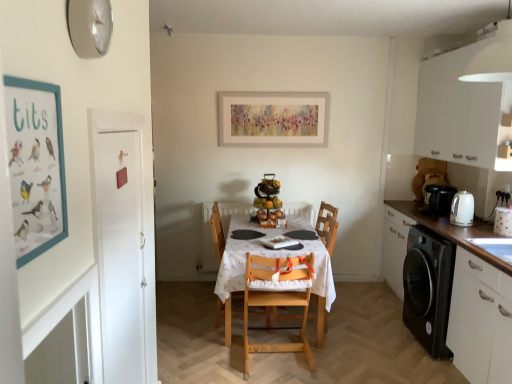
The image size is (512, 384). Find the location of `white matte door at left`. white matte door at left is located at coordinates (120, 252).

In order to face white matte door at left, should I rotate leftwards or rightwards?

Rotate your view left by about 17.303°.

Identify the location of white wood table at center. pos(324,278).

What do you see at coordinates (324, 278) in the screenshot?
I see `white wood table at center` at bounding box center [324, 278].

This screenshot has height=384, width=512. What do you see at coordinates (327, 225) in the screenshot?
I see `wooden highchair at center` at bounding box center [327, 225].

The width and height of the screenshot is (512, 384). What are the coordinates of `white matte cabinet at upper right, which is counted as the 1th cabinetry, starting from the top` in the screenshot? It's located at (x=468, y=103).

Is white ceramic kettle at right, acting as the first appliance starting from the right, next to white matte cabinet at upper right, which is the 2th cabinetry in bottom-to-top order?

white ceramic kettle at right, acting as the first appliance starting from the right, is not next to white matte cabinet at upper right, which is the 2th cabinetry in bottom-to-top order, and they're not touching.

Locate an element on the screen. The width and height of the screenshot is (512, 384). cabinetry that is the 1st one when counting leftward from the white ceramic kettle at right, which is the second appliance from left to right is located at coordinates (468, 103).

Can you tell me how much white ceramic kettle at right, placed as the 2th appliance when sorted from back to front, and white matte cabinet at upper right, which is the 2th cabinetry in bottom-to-top order, differ in facing direction?

They differ by 7.65e-05 degrees in their facing directions.

From the picture: Is white ceramic kettle at right, placed as the 2th appliance when sorted from back to front, smaller than white matte cabinet at upper right, which is the 2th cabinetry in bottom-to-top order?

Correct, white ceramic kettle at right, placed as the 2th appliance when sorted from back to front, occupies less space than white matte cabinet at upper right, which is the 2th cabinetry in bottom-to-top order.

Between natural wood highchair at center, positioned as the second chair in back-to-front order, and silver metallic clock at upper left, which one appears on the right side from the viewer's perspective?

From the viewer's perspective, natural wood highchair at center, positioned as the second chair in back-to-front order, appears more on the right side.

Is natural wood highchair at center, positioned as the second chair in back-to-front order, facing towards silver metallic clock at upper left?

No, natural wood highchair at center, positioned as the second chair in back-to-front order, is not aimed at silver metallic clock at upper left.

Is the position of natural wood highchair at center, arranged as the first chair when viewed from the front, less distant than that of silver metallic clock at upper left?

No, it is not.

From the image's perspective, is natural wood highchair at center, arranged as the first chair when viewed from the front, beneath silver metallic clock at upper left?

Yes, from the image's perspective, natural wood highchair at center, arranged as the first chair when viewed from the front, is beneath silver metallic clock at upper left.

From a real-world perspective, which object rests below the other?

From a 3D spatial view, natural wood highchair at center, arranged as the first chair when viewed from the front, is below.

How different are the orientations of natural wood highchair at center, positioned as the second chair in back-to-front order, and matte cardboard poster at left in degrees?

The facing directions of natural wood highchair at center, positioned as the second chair in back-to-front order, and matte cardboard poster at left are 90 degrees apart.

Which is in front, point (301, 324) or point (9, 94)?

The point (9, 94) is closer.

Considering the relative sizes of natural wood highchair at center, positioned as the second chair in back-to-front order, and matte cardboard poster at left in the image provided, is natural wood highchair at center, positioned as the second chair in back-to-front order, shorter than matte cardboard poster at left?

In fact, natural wood highchair at center, positioned as the second chair in back-to-front order, may be taller than matte cardboard poster at left.

Could you tell me if white glossy cabinet at lower right, the 1th cabinetry in the bottom-to-top sequence, is turned towards white ceramic kettle at right, placed as the 2th appliance when sorted from back to front?

No, white glossy cabinet at lower right, the 1th cabinetry in the bottom-to-top sequence, is not aimed at white ceramic kettle at right, placed as the 2th appliance when sorted from back to front.

In terms of height, does white glossy cabinet at lower right, the 1th cabinetry in the bottom-to-top sequence, look taller or shorter compared to white ceramic kettle at right, which is the second appliance from left to right?

In the image, white glossy cabinet at lower right, the 1th cabinetry in the bottom-to-top sequence, appears to be taller than white ceramic kettle at right, which is the second appliance from left to right.

From a real-world perspective, is white glossy cabinet at lower right, the 1th cabinetry in the bottom-to-top sequence, under white ceramic kettle at right, acting as the first appliance starting from the right?

Yes, from a real-world perspective, white glossy cabinet at lower right, the 1th cabinetry in the bottom-to-top sequence, is under white ceramic kettle at right, acting as the first appliance starting from the right.

Is white glossy cabinet at lower right, the 1th cabinetry in the bottom-to-top sequence, to the right of white ceramic kettle at right, acting as the first appliance starting from the right, from the viewer's perspective?

No, white glossy cabinet at lower right, the 1th cabinetry in the bottom-to-top sequence, is not to the right of white ceramic kettle at right, acting as the first appliance starting from the right.

Considering the sizes of objects black plastic coffee machine at right and white glossy cabinet at lower right, which is counted as the second cabinetry, starting from the top, in the image provided, who is taller, black plastic coffee machine at right or white glossy cabinet at lower right, which is counted as the second cabinetry, starting from the top,?

Standing taller between the two is white glossy cabinet at lower right, which is counted as the second cabinetry, starting from the top.

Considering the positions of objects black plastic coffee machine at right and white glossy cabinet at lower right, which is counted as the second cabinetry, starting from the top, in the image provided, who is more to the right, black plastic coffee machine at right or white glossy cabinet at lower right, which is counted as the second cabinetry, starting from the top,?

From the viewer's perspective, black plastic coffee machine at right appears more on the right side.

Which of these two, black plastic coffee machine at right or white glossy cabinet at lower right, which is counted as the second cabinetry, starting from the top, is bigger?

With larger size is white glossy cabinet at lower right, which is counted as the second cabinetry, starting from the top.

Can you see black plastic coffee machine at right touching white glossy cabinet at lower right, which is counted as the second cabinetry, starting from the top?

There is a gap between black plastic coffee machine at right and white glossy cabinet at lower right, which is counted as the second cabinetry, starting from the top.

Considering the sizes of objects white matte door at left and wooden chair at center, which is counted as the first chair, starting from the back, in the image provided, who is wider, white matte door at left or wooden chair at center, which is counted as the first chair, starting from the back,?

wooden chair at center, which is counted as the first chair, starting from the back.

Does white matte door at left have a larger size compared to wooden chair at center, which is counted as the first chair, starting from the back?

No, white matte door at left is not bigger than wooden chair at center, which is counted as the first chair, starting from the back.

From the image's perspective, is white matte door at left located above or below wooden chair at center, acting as the second chair starting from the front?

white matte door at left is above wooden chair at center, acting as the second chair starting from the front.

Is white wood table at center wider or thinner than wooden chair at center, acting as the second chair starting from the front?

white wood table at center is wider than wooden chair at center, acting as the second chair starting from the front.

Between white wood table at center and wooden chair at center, which is counted as the first chair, starting from the back, which one appears on the left side from the viewer's perspective?

Positioned to the left is wooden chair at center, which is counted as the first chair, starting from the back.

Is point (317, 326) closer to viewer compared to point (213, 224)?

That is True.

Consider the image. Is wooden chair at center, which is counted as the first chair, starting from the back, a part of white wood table at center?

Indeed, wooden chair at center, which is counted as the first chair, starting from the back, is located within white wood table at center.

From the white matte cabinet at upper right, which is counted as the 1th cabinetry, starting from the top, count 1st appliances backward and point to it. Please provide its 2D coordinates.

[(503, 221)]

The height and width of the screenshot is (384, 512). Find the location of `the 2nd chair counting from the right of the silver metallic clock at upper left`. the 2nd chair counting from the right of the silver metallic clock at upper left is located at coordinates (278, 301).

When comparing their distances from wooden highchair at center, does matte cardboard poster at left or natural wood highchair at center, arranged as the first chair when viewed from the front, seem closer?

Based on the image, natural wood highchair at center, arranged as the first chair when viewed from the front, appears to be nearer to wooden highchair at center.

Considering their positions, is white glossy cabinet at lower right, the 1th cabinetry in the bottom-to-top sequence, positioned closer to white glossy electric kettle at right, positioned as the 2th appliance in right-to-left order, than white wood table at center?

white glossy cabinet at lower right, the 1th cabinetry in the bottom-to-top sequence, lies closer to white glossy electric kettle at right, positioned as the 2th appliance in right-to-left order, than the other object.

Based on their spatial positions, is white glossy electric kettle at right, positioned as the 2th appliance in right-to-left order, or wooden chair at center, acting as the second chair starting from the front, further from white matte cabinet at upper right, which is counted as the 1th cabinetry, starting from the top?

wooden chair at center, acting as the second chair starting from the front, is further to white matte cabinet at upper right, which is counted as the 1th cabinetry, starting from the top.

When comparing their distances from white matte drawer at lower right, does white ceramic kettle at right, placed as the 2th appliance when sorted from back to front, or silver metallic clock at upper left seem further?

silver metallic clock at upper left is further to white matte drawer at lower right.

Which object lies nearer to the anchor point black plastic coffee machine at right, white glossy electric kettle at right, arranged as the 1th appliance when viewed from the back, or white matte door at left?

Based on the image, white glossy electric kettle at right, arranged as the 1th appliance when viewed from the back, appears to be nearer to black plastic coffee machine at right.

Which object lies further to the anchor point white glossy electric kettle at right, the 2th appliance viewed from the front, white matte door at left or black plastic coffee machine at right?

Among the two, white matte door at left is located further to white glossy electric kettle at right, the 2th appliance viewed from the front.

Considering their positions, is white glossy electric kettle at right, positioned as the 2th appliance in right-to-left order, positioned closer to white matte cabinet at upper right, which is the 2th cabinetry in bottom-to-top order, than white wood table at center?

Among the two, white glossy electric kettle at right, positioned as the 2th appliance in right-to-left order, is located nearer to white matte cabinet at upper right, which is the 2th cabinetry in bottom-to-top order.

Looking at the image, which one is located further to natural wood highchair at center, arranged as the first chair when viewed from the front, wooden highchair at center or matte cardboard poster at left?

Among the two, matte cardboard poster at left is located further to natural wood highchair at center, arranged as the first chair when viewed from the front.

Where is `kitchen & dining room table situated between wooden chair at center, acting as the second chair starting from the front, and white glossy cabinet at lower right, which is counted as the second cabinetry, starting from the top, from left to right`? kitchen & dining room table situated between wooden chair at center, acting as the second chair starting from the front, and white glossy cabinet at lower right, which is counted as the second cabinetry, starting from the top, from left to right is located at coordinates (324, 278).

You are a GUI agent. You are given a task and a screenshot of the screen. Output one action in this format:
    pyautogui.click(x=<x>, y=<y>)
    Task: Click on the armchair between natural wood highchair at center, arranged as the first chair when viewed from the front, and white matte drawer at lower right
    The width and height of the screenshot is (512, 384).
    Given the screenshot: What is the action you would take?
    pyautogui.click(x=327, y=225)

This screenshot has height=384, width=512. I want to click on appliance between white matte door at left and white matte cabinet at upper right, which is counted as the 1th cabinetry, starting from the top, in the horizontal direction, so click(462, 209).

What are the coordinates of `chair located between white matte door at left and wooden highchair at center in the depth direction` in the screenshot? It's located at (278, 301).